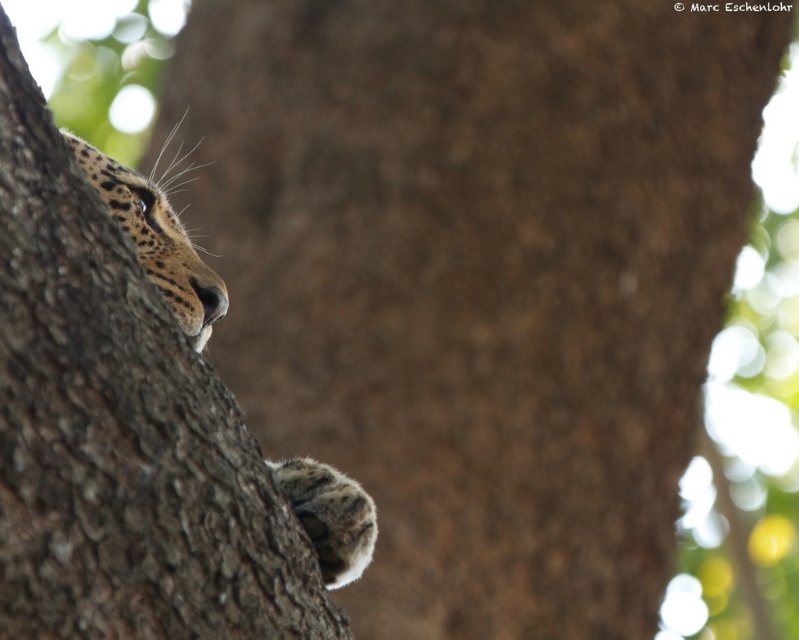
Identify the location of brown rough tree trunk at left. (120, 433).

Consider the image. Does brown rough tree trunk at left appear on the left side of spotted fur paw at lower center?

Indeed, brown rough tree trunk at left is positioned on the left side of spotted fur paw at lower center.

What do you see at coordinates (120, 433) in the screenshot? The image size is (799, 640). I see `brown rough tree trunk at left` at bounding box center [120, 433].

This screenshot has height=640, width=799. What are the coordinates of `brown rough tree trunk at left` in the screenshot? It's located at (120, 433).